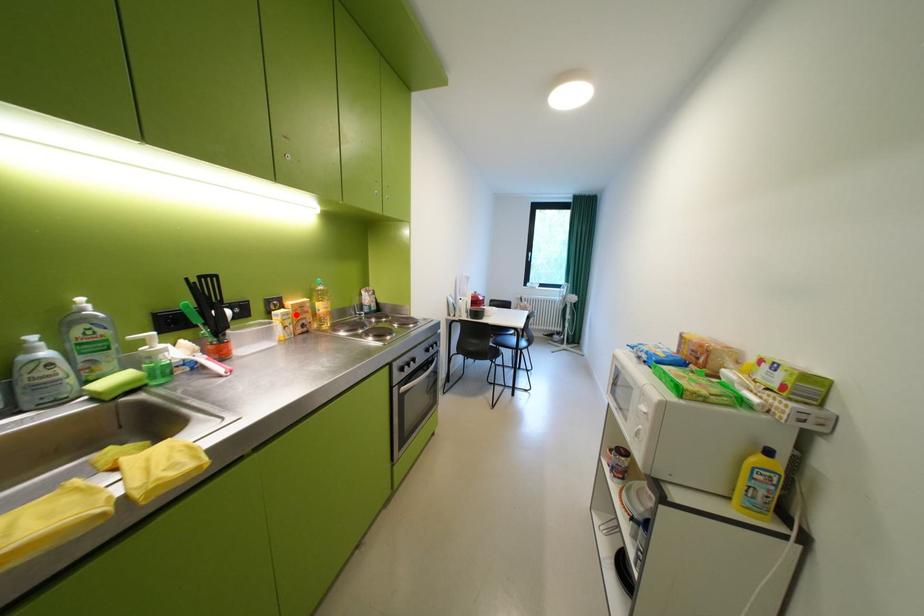
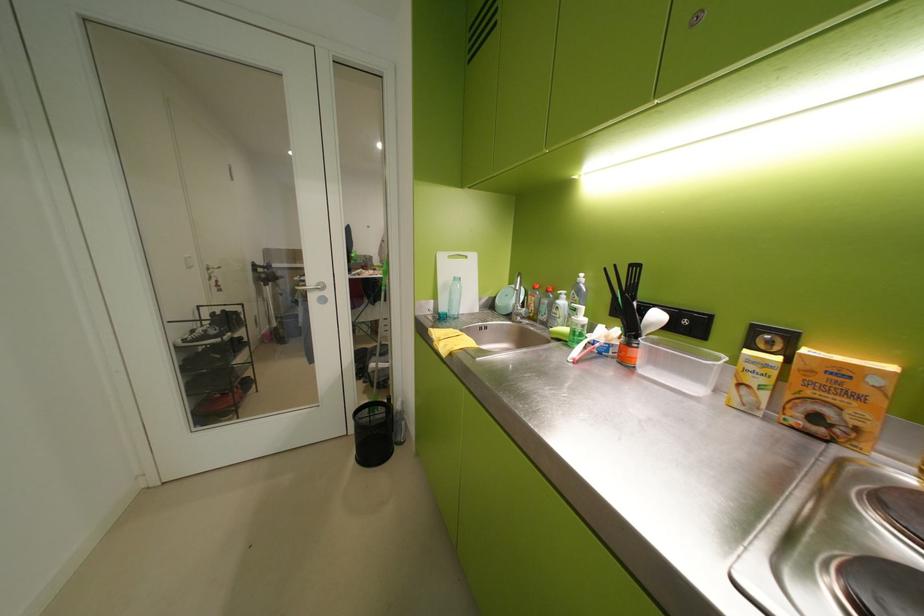
Where in the second image is the point corresponding to the highlighted location from the first image?

(773, 365)